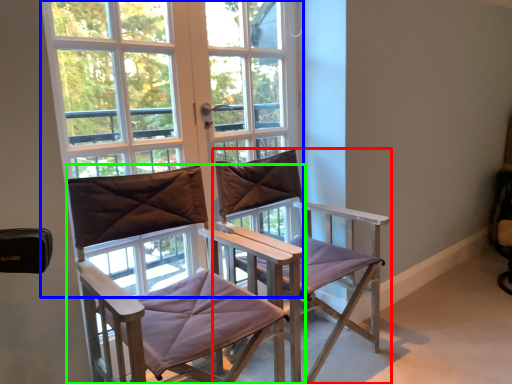
Question: Considering the real-world distances, which object is farthest from chair (highlighted by a red box)? window (highlighted by a blue box) or chair (highlighted by a green box)?

Choices:
 (A) window
 (B) chair

Answer: (A)